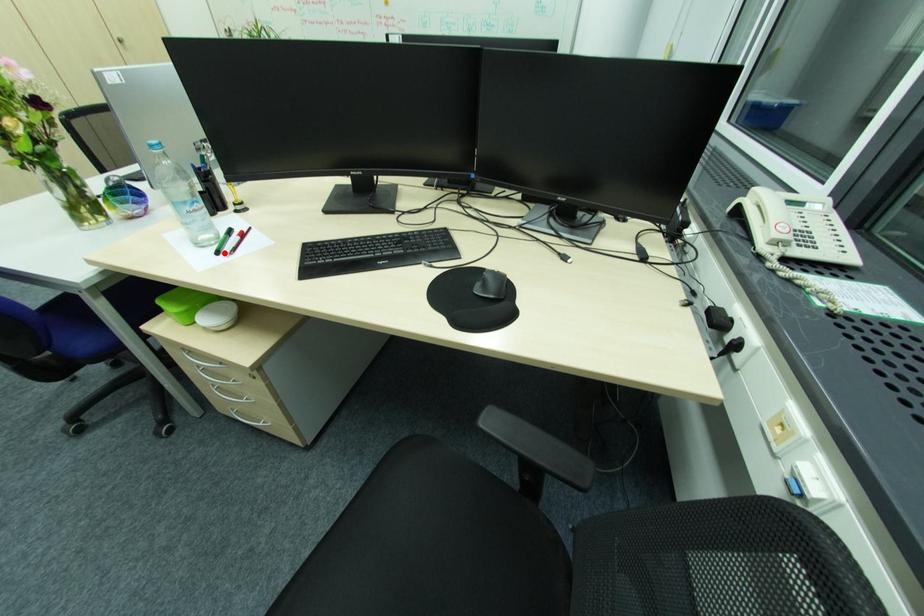
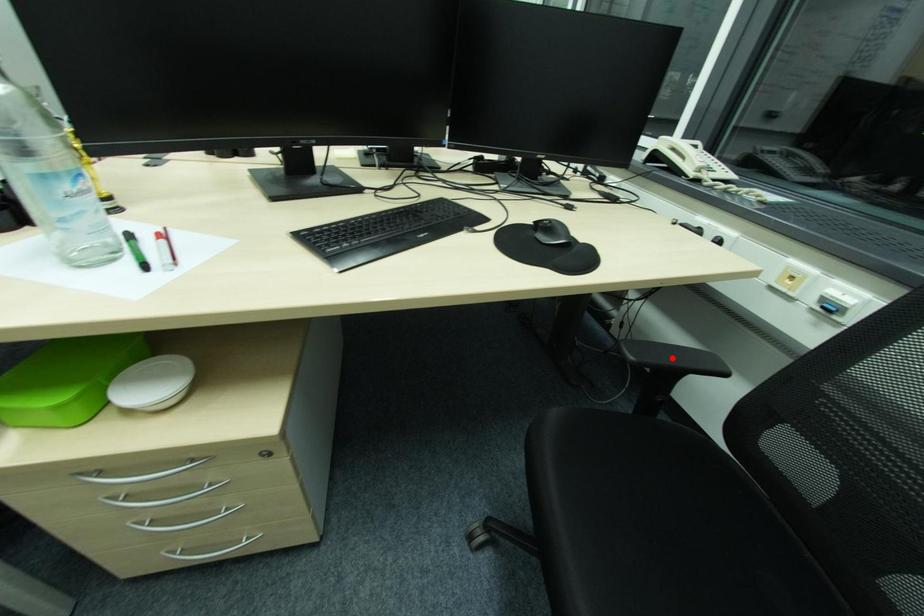
I am providing you with two images of the same scene from different viewpoints. A red point is marked on the first image and another point is marked on the second image. Are the points marked in image1 and image2 representing the same 3D position?

No